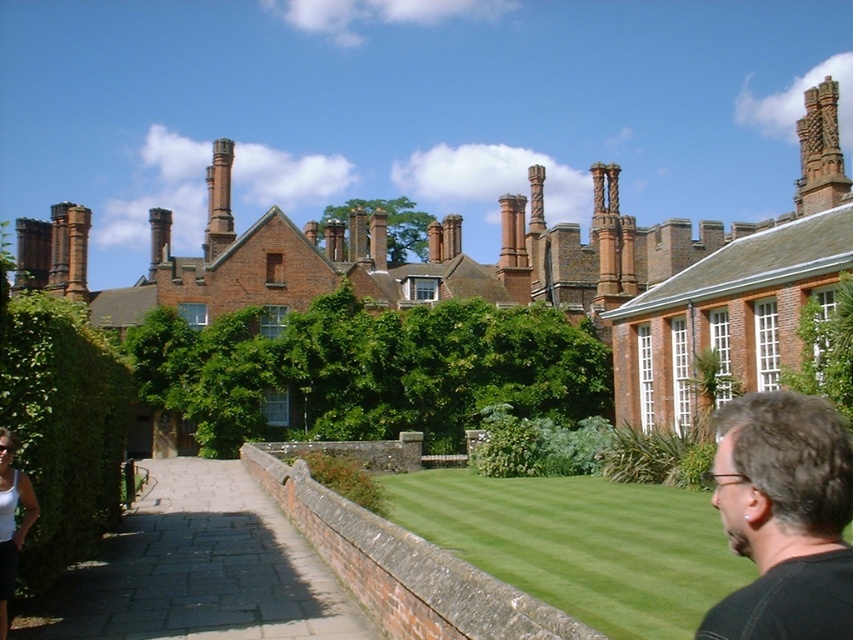
You are an architect analyzing the historic building. You notice the brown textured chimney at upper right and the white fabric at lower left. Which object has a greater width?

The brown textured chimney at upper right has a greater width than the white fabric at lower left.

You are standing in the garden of the historic building and notice two features in the scene. One is the dark brown hair at lower right and the other is the brown textured chimney at upper right. From your vantage point, which object is closer to you?

The dark brown hair at lower right is closer to you because it is positioned in front of the brown textured chimney at upper right.

You are standing in the garden in front of the historic building. You see a point marked at coordinates [784,516]. What object is located at that point?

The point at coordinates [784,516] is located on dark brown hair at lower right.